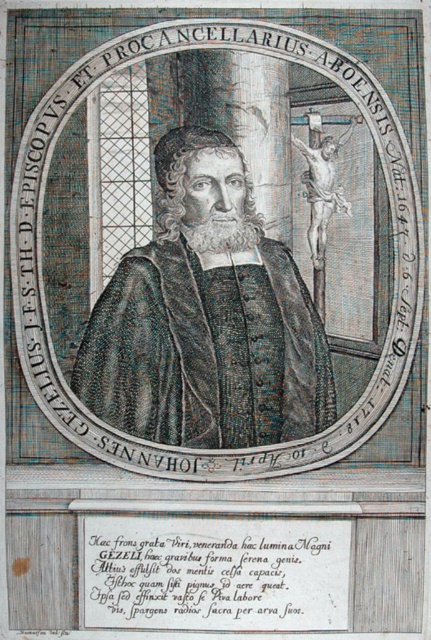
Based on the scene description, which object is positioned higher up in the image between the black textured robe at center and the black paper text at lower center?

The black textured robe at center is positioned higher up in the image than the black paper text at lower center because it is described as much taller.

Based on the scene description, you are examining an engraved portrait of a religious figure. The portrait includes a black textured robe at center and black paper text at lower center. Which object is positioned higher in the image?

The black textured robe at center is located above the black paper text at lower center in the image.